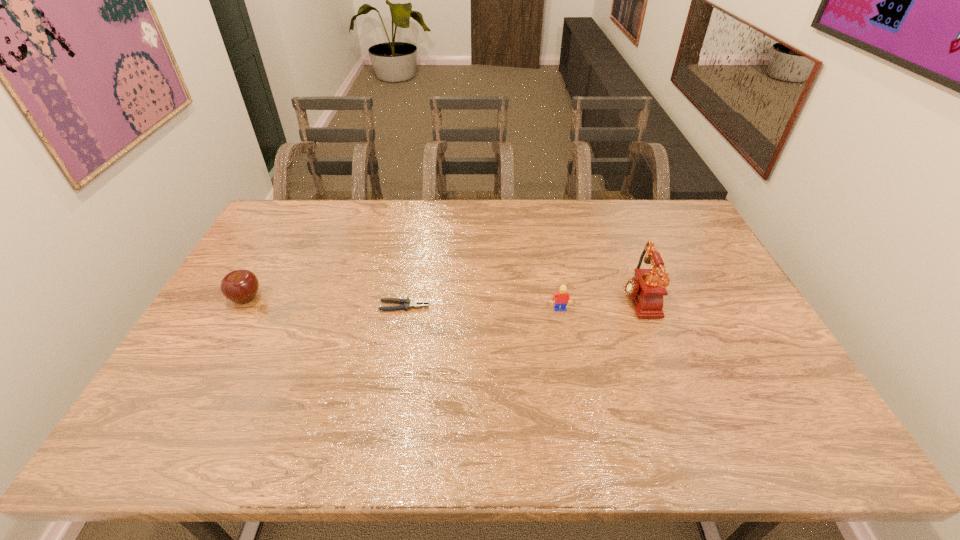
This screenshot has height=540, width=960. I want to click on vacant area that lies between the Lego and the tallest object, so click(x=598, y=304).

This screenshot has height=540, width=960. What are the coordinates of `free space between the rightmost object and the apple` in the screenshot? It's located at (442, 298).

Where is `vacant area that lies between the tallest object and the shortest object`? This screenshot has width=960, height=540. vacant area that lies between the tallest object and the shortest object is located at coordinates (520, 302).

Locate an element on the screen. This screenshot has height=540, width=960. empty location between the apple and the shortest object is located at coordinates (325, 302).

Find the location of a particular element. free space between the telephone and the Lego is located at coordinates (598, 304).

I want to click on object that ranks as the closest to the rightmost object, so click(561, 297).

Identify which object is located as the third nearest to the apple. Please provide its 2D coordinates. Your answer should be formatted as a tuple, i.e. [(x, y)], where the tuple contains the x and y coordinates of a point satisfying the conditions above.

[(646, 289)]

I want to click on vacant region that satisfies the following two spatial constraints: 1. on the dial of the rightmost object; 2. on the front-facing side of the Lego, so click(x=641, y=310).